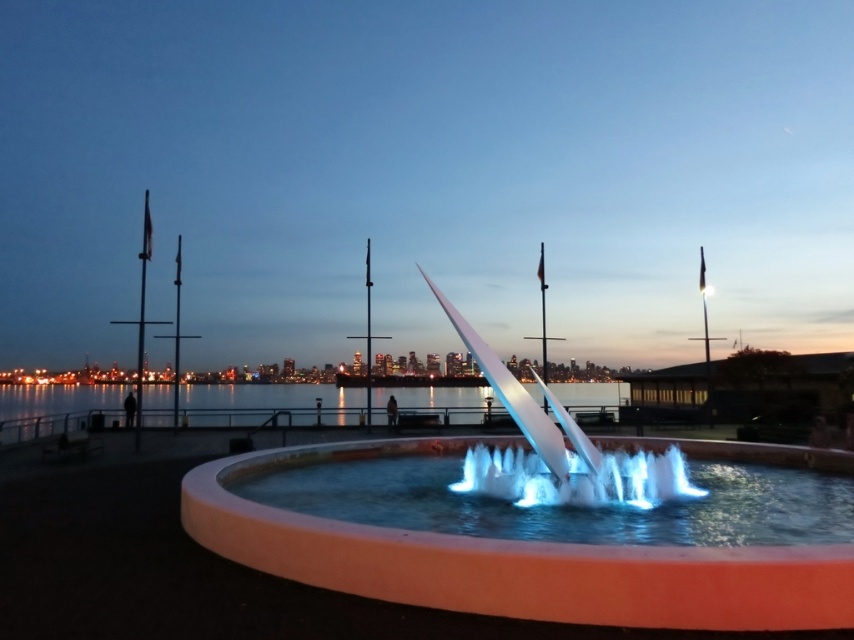
Question: Which object is positioned farthest from the white glossy fountain at center?

Choices:
 (A) translucent glass water at center
 (B) clear water at center

Answer: (B)

Question: Which object is closer to the camera taking this photo?

Choices:
 (A) white glossy fountain at center
 (B) translucent glass water at center

Answer: (A)

Question: Can you confirm if white glossy fountain at center is positioned below clear water at center?

Choices:
 (A) yes
 (B) no

Answer: (B)

Question: Which object appears closest to the camera in this image?

Choices:
 (A) translucent glass water at center
 (B) clear water at center

Answer: (A)

Question: Can you confirm if white glossy fountain at center is positioned to the right of translucent glass water at center?

Choices:
 (A) no
 (B) yes

Answer: (A)

Question: Can you confirm if white glossy fountain at center is positioned above clear water at center?

Choices:
 (A) yes
 (B) no

Answer: (A)